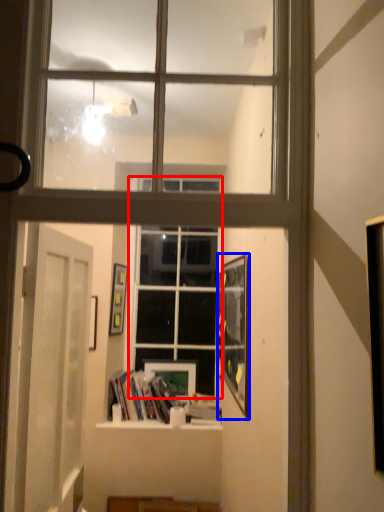
Question: Which object is closer to the camera taking this photo, window (highlighted by a red box) or picture frame (highlighted by a blue box)?

Choices:
 (A) window
 (B) picture frame

Answer: (B)